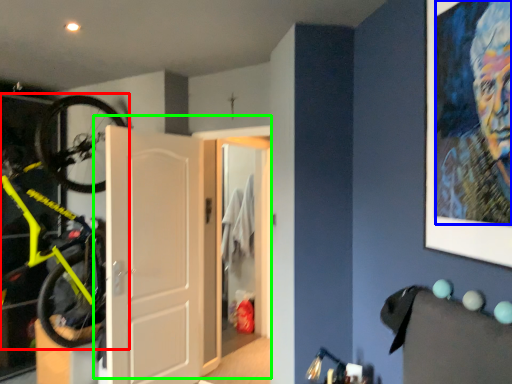
Question: Based on their relative distances, which object is nearer to bicycle (highlighted by a red box)? Choose from person (highlighted by a blue box) and door (highlighted by a green box).

Choices:
 (A) person
 (B) door

Answer: (B)